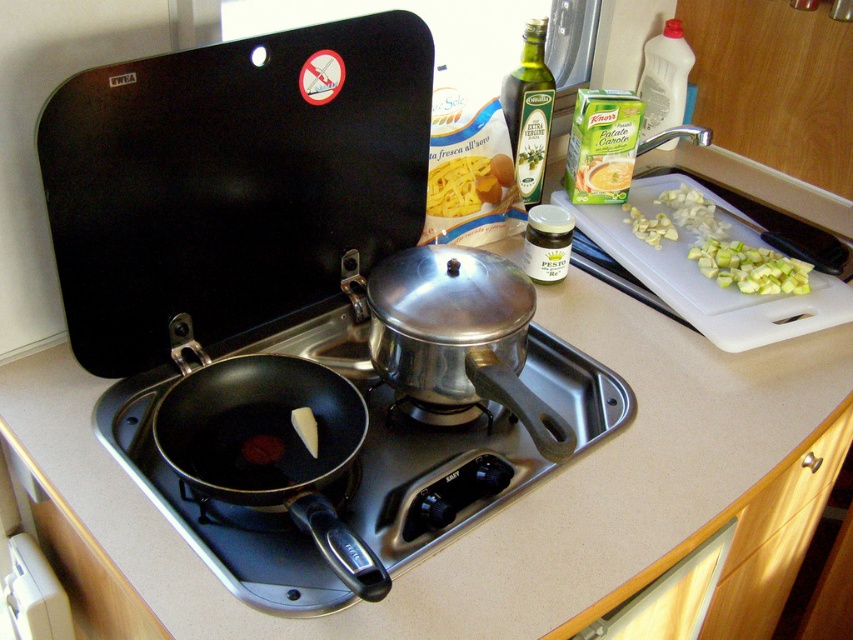
Between black matte pan at lower left and white plastic cutting board at upper right, which one has more height?

With more height is white plastic cutting board at upper right.

Does black matte pan at lower left have a greater height compared to white plastic cutting board at upper right?

No, black matte pan at lower left is not taller than white plastic cutting board at upper right.

Does point (590, 436) come farther from viewer compared to point (798, 336)?

No, (590, 436) is in front of (798, 336).

The image size is (853, 640). Find the location of `black matte pan at lower left`. black matte pan at lower left is located at coordinates (404, 448).

Measure the distance from black matte pan at lower left to matte black frying pan at lower left.

3.44 inches

Which is above, black matte pan at lower left or matte black frying pan at lower left?

black matte pan at lower left is above.

Which is in front, point (279, 529) or point (316, 528)?

Point (316, 528) is in front.

Locate an element on the screen. This screenshot has height=640, width=853. black matte pan at lower left is located at coordinates (404, 448).

Can you confirm if matte black frying pan at lower left is positioned to the left of white plastic cutting board at upper right?

Yes, matte black frying pan at lower left is to the left of white plastic cutting board at upper right.

Does point (215, 397) lie behind point (689, 179)?

No, it is not.

Locate an element on the screen. The width and height of the screenshot is (853, 640). matte black frying pan at lower left is located at coordinates (270, 444).